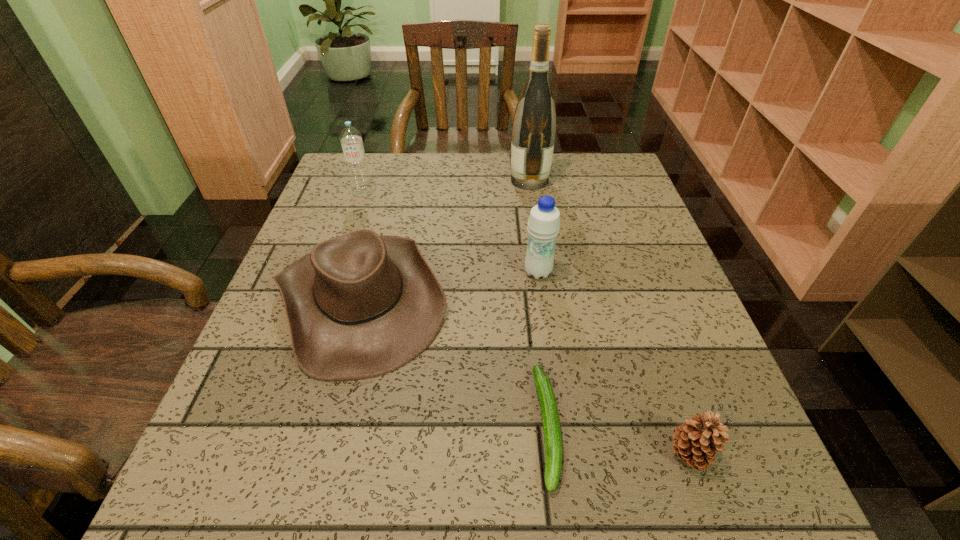
Locate an element on the screen. Image resolution: width=960 pixels, height=540 pixels. object that is the fourth closest to the left water bottle is located at coordinates (550, 417).

Image resolution: width=960 pixels, height=540 pixels. In order to click on object that is the fourth closest to the right water bottle in this screenshot , I will do `click(696, 442)`.

This screenshot has width=960, height=540. In order to click on blank area in the image that satisfies the following two spatial constraints: 1. on the front side of the left water bottle; 2. on the left side of the rightmost object in this screenshot , I will do `click(273, 454)`.

Image resolution: width=960 pixels, height=540 pixels. In order to click on free spot that satisfies the following two spatial constraints: 1. on the front-facing side of the pinecone; 2. on the right side of the zucchini in this screenshot , I will do `click(551, 454)`.

The width and height of the screenshot is (960, 540). What are the coordinates of `vacant space that satisfies the following two spatial constraints: 1. on the label of the wine bottle; 2. on the front side of the nearer water bottle` in the screenshot? It's located at (543, 272).